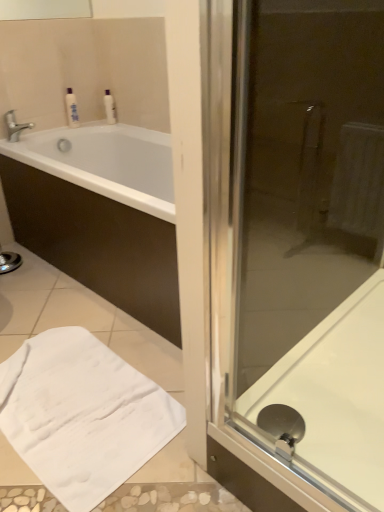
Question: In terms of width, does white soft towel at lower left look wider or thinner when compared to white glossy bottle at upper left, acting as the 1th toiletry starting from the right?

Choices:
 (A) wide
 (B) thin

Answer: (A)

Question: Is white soft towel at lower left taller or shorter than white glossy bottle at upper left, acting as the 1th toiletry starting from the right?

Choices:
 (A) tall
 (B) short

Answer: (B)

Question: Estimate the real-world distances between objects in this image. Which object is closer to the silver metallic faucet at upper left?

Choices:
 (A) white glossy bottle at upper left, which is the 2th toiletry from left to right
 (B) white soft towel at lower left
 (C) white glossy bathtub at upper left
 (D) white glossy bath at right
 (E) white glossy bottle at upper left, the 2th toiletry when ordered from right to left

Answer: (E)

Question: Which of these objects is positioned closest to the white soft towel at lower left?

Choices:
 (A) white glossy bottle at upper left, which is the 2th toiletry from left to right
 (B) white glossy bathtub at upper left
 (C) white glossy bath at right
 (D) silver metallic faucet at upper left
 (E) white glossy bottle at upper left, the first toiletry viewed from the left

Answer: (C)